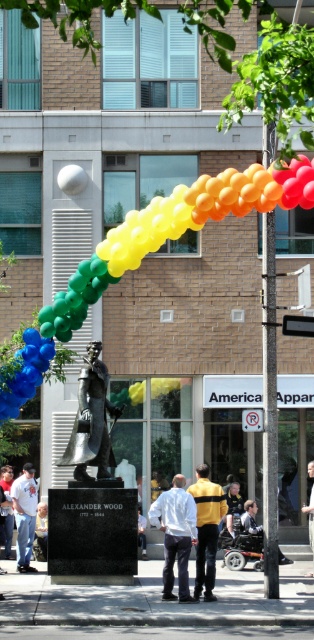
Question: Where is blue glossy balloon at left located in relation to white shirt at lower left in the image?

Choices:
 (A) left
 (B) right

Answer: (B)

Question: Which object is farther from the camera taking this photo?

Choices:
 (A) blue glossy balloon at left
 (B) white shirt at center

Answer: (B)

Question: Considering the real-world distances, which object is farthest from the white shirt at lower left?

Choices:
 (A) bronze statue at center
 (B) blue glossy balloon at left
 (C) yellow textured shirt at center

Answer: (C)

Question: Does white matte shirt at center appear on the left side of yellow matte jacket at center?

Choices:
 (A) yes
 (B) no

Answer: (A)

Question: Which of the following is the closest to the observer?

Choices:
 (A) yellow textured shirt at center
 (B) green matte balloons at center
 (C) yellow matte jacket at center

Answer: (B)

Question: Is bronze statue at center smaller than white cotton shirt at lower left?

Choices:
 (A) no
 (B) yes

Answer: (A)